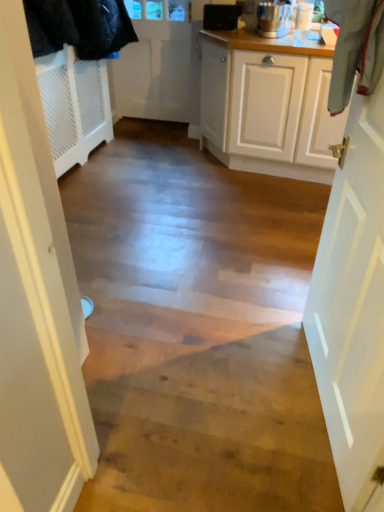
Question: Is white matte door at right, placed as the first door when sorted from right to left, facing away from black plastic speaker at upper center?

Choices:
 (A) yes
 (B) no

Answer: (B)

Question: Is white matte door at right, which is counted as the 1th door, starting from the front, directly adjacent to black plastic speaker at upper center?

Choices:
 (A) yes
 (B) no

Answer: (B)

Question: Can you confirm if white matte door at right, the second door in the back-to-front sequence, is thinner than black plastic speaker at upper center?

Choices:
 (A) no
 (B) yes

Answer: (A)

Question: Can you confirm if white matte door at right, which is counted as the 1th door, starting from the front, is positioned to the right of black plastic speaker at upper center?

Choices:
 (A) yes
 (B) no

Answer: (A)

Question: Is white matte door at right, which is counted as the 1th door, starting from the front, wider than black plastic speaker at upper center?

Choices:
 (A) yes
 (B) no

Answer: (A)

Question: Is polished stainless steel blender at upper right in front of or behind black plastic speaker at upper center in the image?

Choices:
 (A) behind
 (B) front

Answer: (B)

Question: Is polished stainless steel blender at upper right situated inside black plastic speaker at upper center or outside?

Choices:
 (A) outside
 (B) inside

Answer: (A)

Question: In terms of height, does polished stainless steel blender at upper right look taller or shorter compared to black plastic speaker at upper center?

Choices:
 (A) tall
 (B) short

Answer: (A)

Question: From the image's perspective, is polished stainless steel blender at upper right positioned above or below black plastic speaker at upper center?

Choices:
 (A) below
 (B) above

Answer: (A)

Question: Would you say black plastic speaker at upper center is to the left or to the right of polished stainless steel blender at upper right in the picture?

Choices:
 (A) left
 (B) right

Answer: (A)

Question: Considering their positions, is black plastic speaker at upper center located in front of or behind polished stainless steel blender at upper right?

Choices:
 (A) front
 (B) behind

Answer: (B)

Question: Does point (226, 24) appear closer or farther from the camera than point (284, 13)?

Choices:
 (A) farther
 (B) closer

Answer: (A)

Question: Considering the positions of black plastic speaker at upper center and polished stainless steel blender at upper right in the image, is black plastic speaker at upper center taller or shorter than polished stainless steel blender at upper right?

Choices:
 (A) tall
 (B) short

Answer: (B)

Question: From a real-world perspective, is white matte door at upper center, placed as the 1th door when sorted from left to right, physically located above or below white matte door at right, acting as the 2th door starting from the top?

Choices:
 (A) above
 (B) below

Answer: (A)

Question: In terms of width, does white matte door at upper center, acting as the 2th door starting from the bottom, look wider or thinner when compared to white matte door at right, placed as the first door when sorted from right to left?

Choices:
 (A) wide
 (B) thin

Answer: (B)